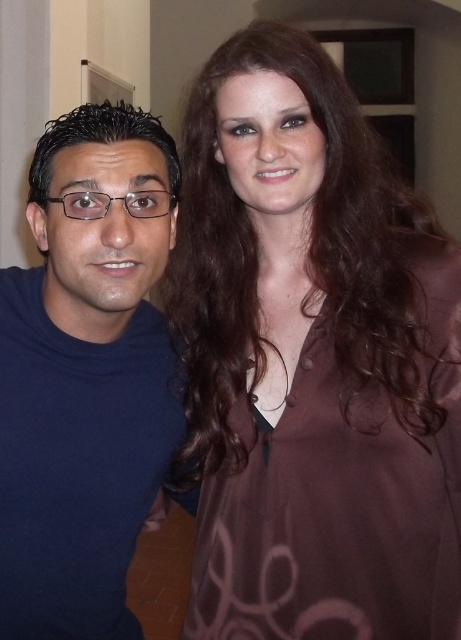
Is point (360, 337) closer to camera compared to point (84, 592)?

That is True.

Describe the element at coordinates (313, 362) in the screenshot. The height and width of the screenshot is (640, 461). I see `brown satin blouse at upper right` at that location.

Find the location of a particular element. brown satin blouse at upper right is located at coordinates 313,362.